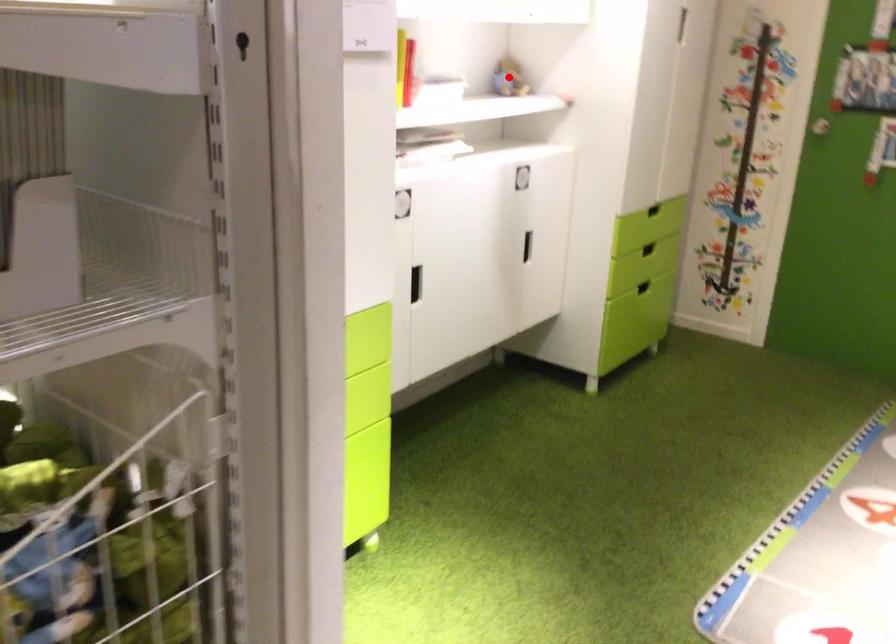
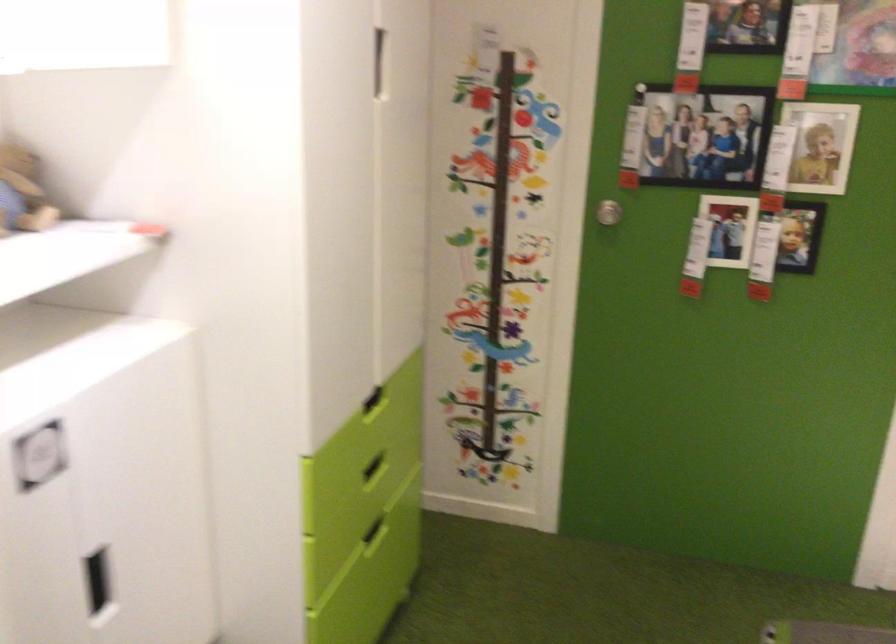
Find the pixel in the second image that matches the highlighted location in the first image.

(22, 192)